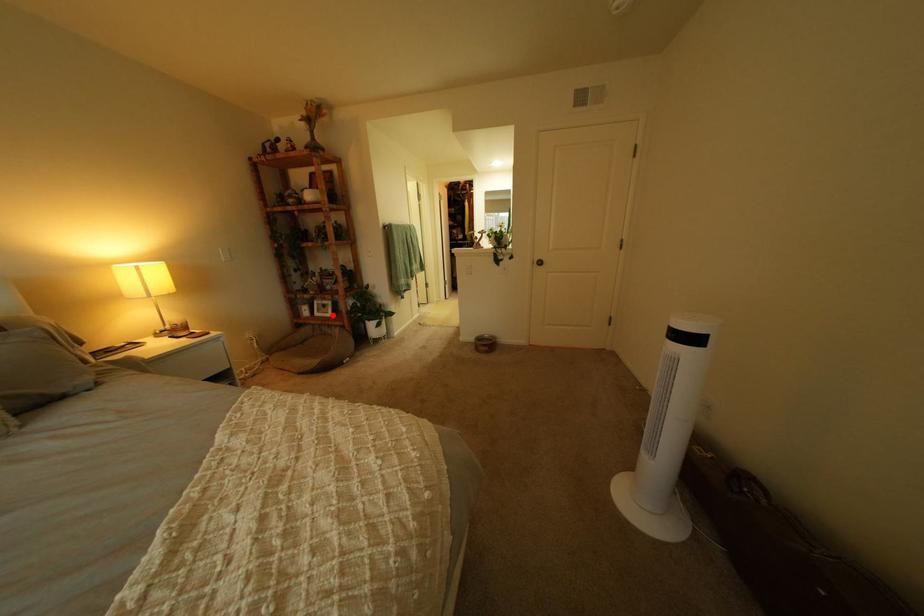
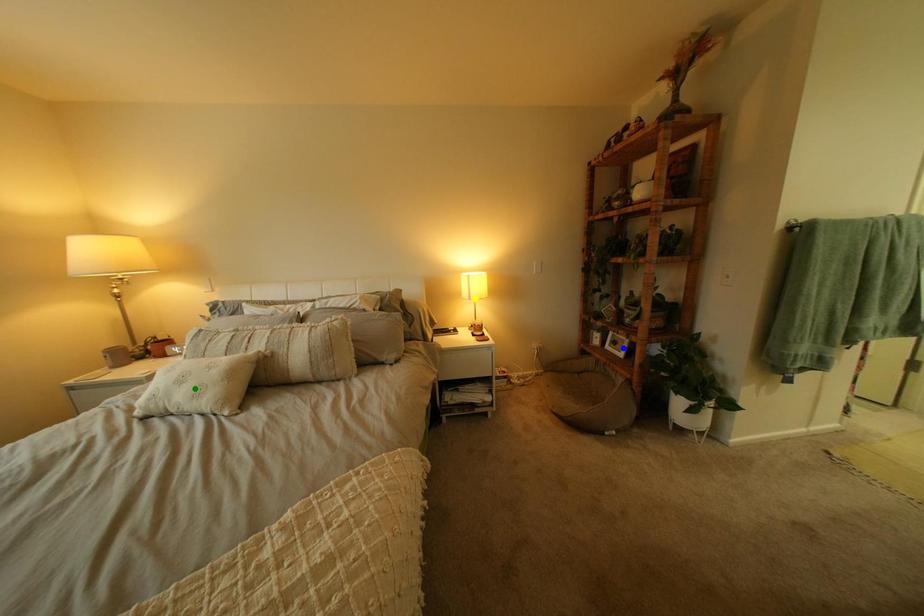
Question: I am providing you with two images of the same scene from different viewpoints. A red point is marked on the first image. You are given multiple points on the second image. Which point in image 2 represents the same 3d spot as the red point in image 1?

Choices:
 (A) yellow point
 (B) blue point
 (C) green point

Answer: (B)